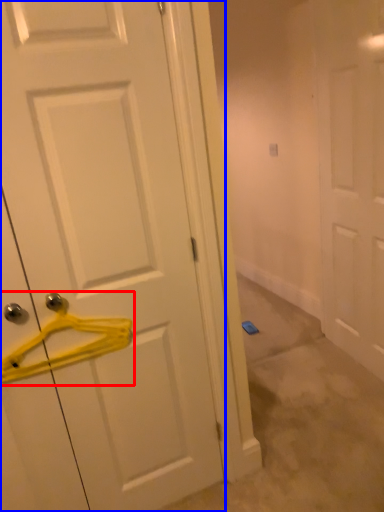
Question: Which object is further to the camera taking this photo, hanger (highlighted by a red box) or door (highlighted by a blue box)?

Choices:
 (A) hanger
 (B) door

Answer: (A)